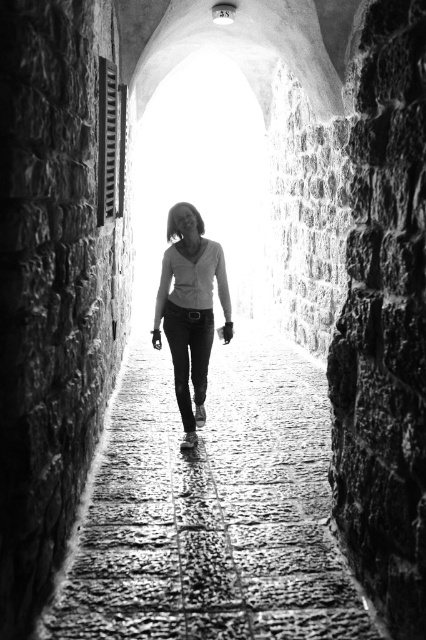
You are standing in the corridor and notice both the smooth stone path at center and the matte white blouse at center. Which object is closer to you from your current position?

The smooth stone path at center is closer to you because it is positioned in front of the matte white blouse at center, indicating it is nearer in the line of sight.

You are standing at the entrance of the corridor and want to walk towards the light at the end. There is a smooth stone path at center and a matte white blouse at center in your way. Which object is closer to you?

The smooth stone path at center is shorter than the matte white blouse at center, so the smooth stone path at center is closer to you.